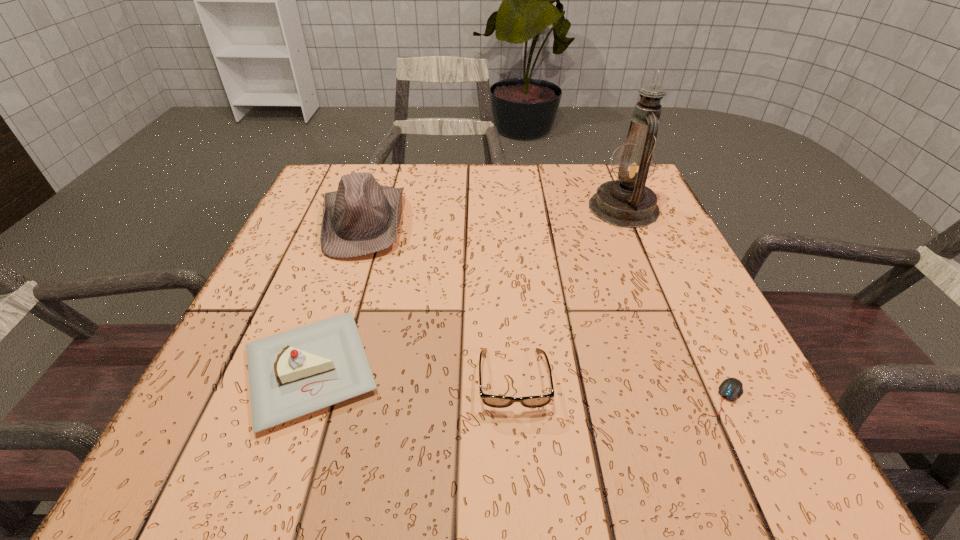
Locate an element on the screen. oil lamp is located at coordinates (627, 202).

Locate an element on the screen. The image size is (960, 540). the second tallest object is located at coordinates (361, 217).

This screenshot has height=540, width=960. In order to click on the third tallest object in this screenshot , I will do `click(291, 374)`.

At what (x,y) coordinates should I click in order to perform the action: click on the second shortest object. Please return your answer as a coordinate pair (x, y). The height and width of the screenshot is (540, 960). Looking at the image, I should click on (495, 401).

The image size is (960, 540). What are the coordinates of `the third object from right to left` in the screenshot? It's located at [495, 401].

Locate an element on the screen. The height and width of the screenshot is (540, 960). mouse is located at coordinates [731, 388].

You are a GUI agent. You are given a task and a screenshot of the screen. Output one action in this format:
    pyautogui.click(x=<x>, y=<y>)
    Task: Click on the free space located 0.180m on the left of the oil lamp
    The height and width of the screenshot is (540, 960).
    Given the screenshot: What is the action you would take?
    pyautogui.click(x=516, y=208)

Find the location of a particular element. This screenshot has width=960, height=540. vacant space located 0.090m on the front of the fedora is located at coordinates (339, 290).

I want to click on blank space located on the back of the cake, so click(345, 271).

Locate an element on the screen. This screenshot has width=960, height=540. vacant area situated 0.080m on the lenses of the third object from right to left is located at coordinates (519, 466).